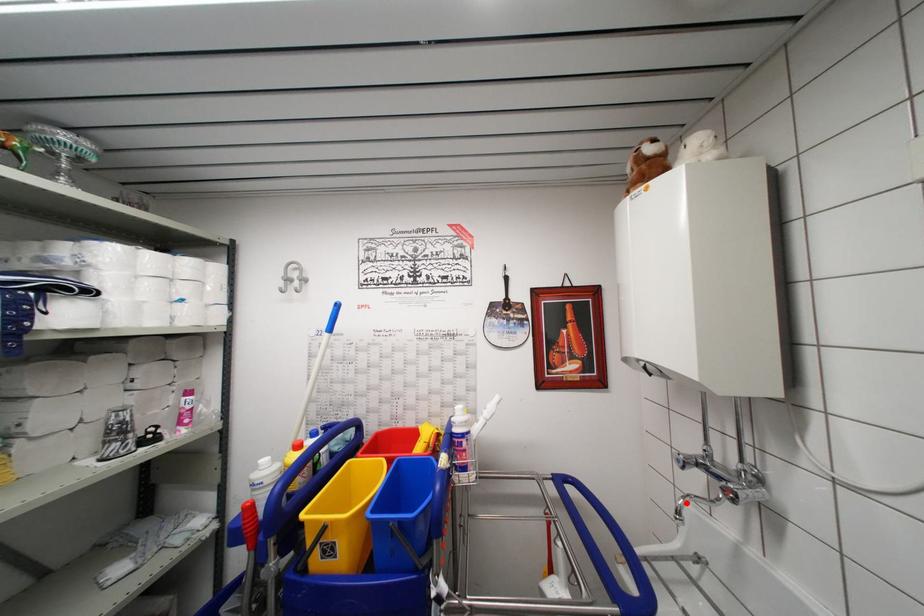
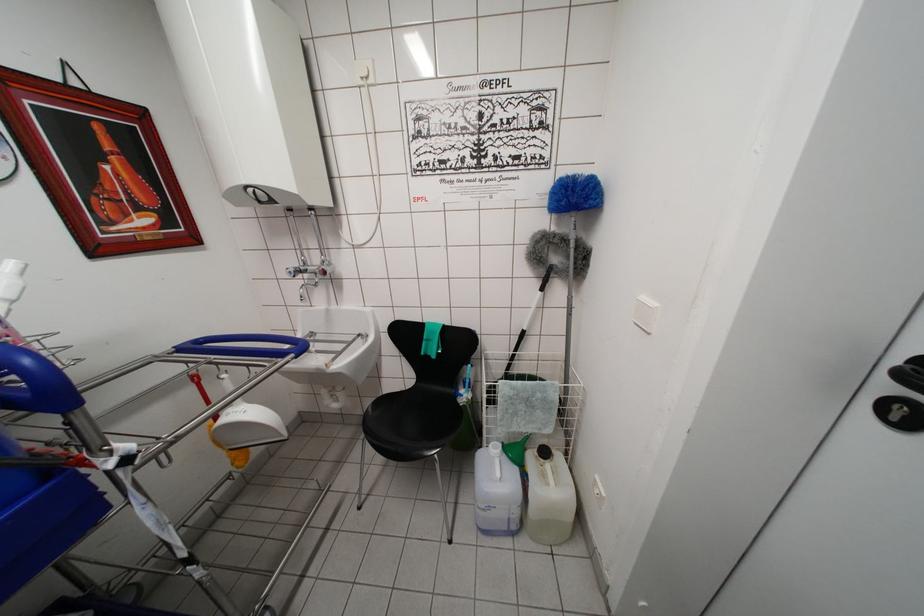
Where in the second image is the point corresponding to the highlighted location from the first image?

(305, 292)